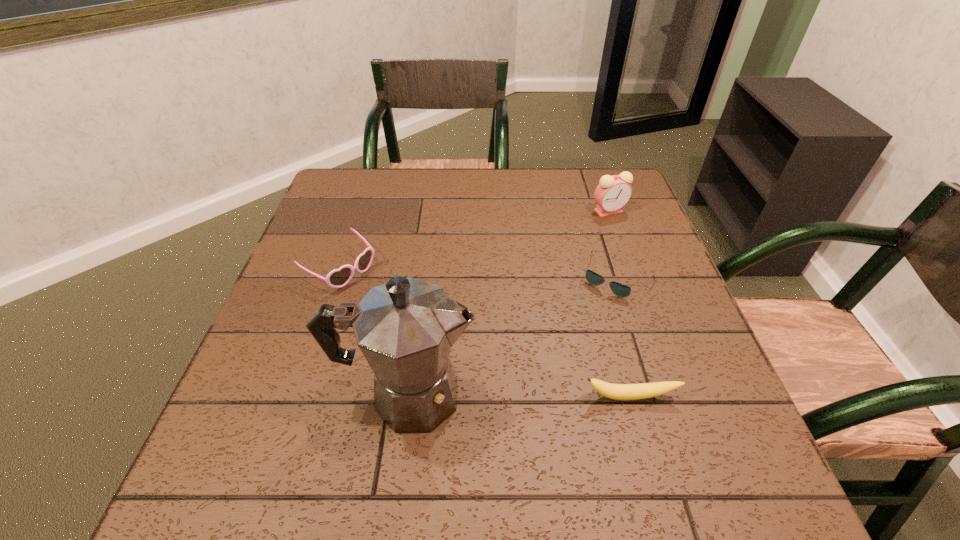
Where is `the tallest object`? the tallest object is located at coordinates (405, 328).

What are the coordinates of `banana` in the screenshot? It's located at (644, 390).

The width and height of the screenshot is (960, 540). Find the location of `alarm clock`. alarm clock is located at coordinates (613, 192).

Find the location of a particular element. The image size is (960, 540). the farthest object is located at coordinates (613, 192).

Locate an element on the screen. The height and width of the screenshot is (540, 960). the shorter sunglasses is located at coordinates (620, 290).

Where is `the right sunglasses`? The height and width of the screenshot is (540, 960). the right sunglasses is located at coordinates (620, 290).

The width and height of the screenshot is (960, 540). In order to click on the taller sunglasses in this screenshot , I will do `click(338, 278)`.

The height and width of the screenshot is (540, 960). Identify the location of free region located on the pouring side of the tallest object. [692, 395].

You are a GUI agent. You are given a task and a screenshot of the screen. Output one action in this format:
    pyautogui.click(x=<x>, y=<y>)
    Task: Click on the free location located 0.050m on the upward curve of the banana
    
    Given the screenshot: What is the action you would take?
    pyautogui.click(x=639, y=429)

At what (x,y) coordinates should I click in order to perform the action: click on vacant space located 0.140m on the face of the farthest object. Please return your answer as a coordinate pair (x, y). Image resolution: width=960 pixels, height=540 pixels. Looking at the image, I should click on (594, 248).